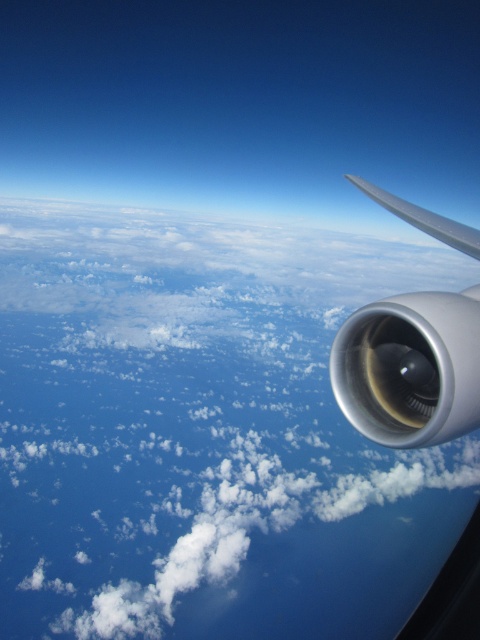
You are a pilot looking at the aircraft window. Where is the sleek metallic engine at right located in terms of its 2D coordinates on the window?

The sleek metallic engine at right is located at the 2D coordinates of point (410, 368) on the window.

You are a pilot looking at the clouds outside the aircraft window. The engine is partially visible on the right side of the window. Where is the white fluffy cloud at upper center located relative to the engine?

The white fluffy cloud at upper center is located at coordinates point (204, 433) relative to the engine.

You are a pilot observing the scene from the cockpit window. You notice the white fluffy cloud at upper center and the sleek metallic engine at right. Which object appears wider when viewed from your perspective?

The white fluffy cloud at upper center appears wider than the sleek metallic engine at right because its width surpasses that of the engine.